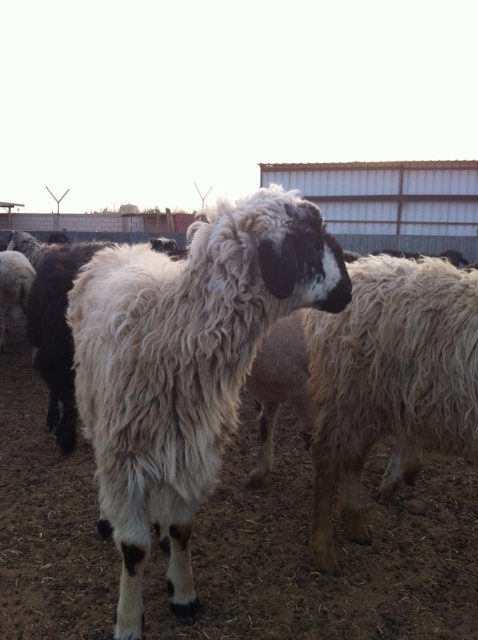
Question: Is white woolen sheep at center thinner than white woolly sheep at center?

Choices:
 (A) yes
 (B) no

Answer: (B)

Question: Does white woolen sheep at center lie in front of white woolly sheep at center?

Choices:
 (A) yes
 (B) no

Answer: (A)

Question: Among these points, which one is nearest to the camera?

Choices:
 (A) (229, 292)
 (B) (369, 300)

Answer: (A)

Question: Which point is closer to the camera?

Choices:
 (A) white woolly sheep at center
 (B) white woolen sheep at center

Answer: (B)

Question: Is white woolen sheep at center further to the viewer compared to white woolly sheep at center?

Choices:
 (A) no
 (B) yes

Answer: (A)